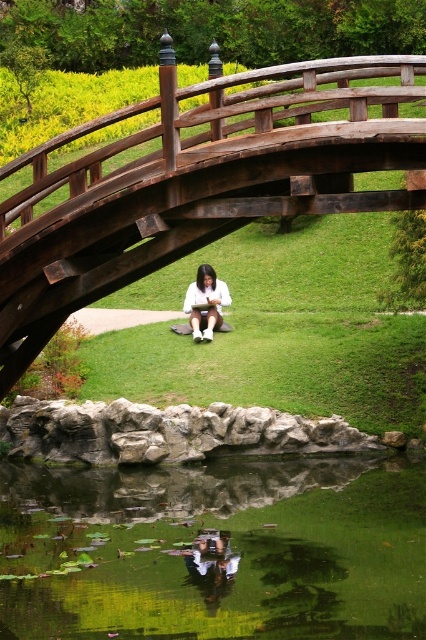
Question: Is green reflective water at center bottom thinner than white matte shirt at center?

Choices:
 (A) no
 (B) yes

Answer: (A)

Question: Is the position of green reflective water at center bottom more distant than that of white matte shirt at center?

Choices:
 (A) yes
 (B) no

Answer: (B)

Question: Which object appears farthest from the camera in this image?

Choices:
 (A) white matte shirt at center
 (B) dark brown wood bridge at center
 (C) green reflective water at center bottom

Answer: (A)

Question: Is green reflective water at center bottom to the left of white matte shirt at center from the viewer's perspective?

Choices:
 (A) no
 (B) yes

Answer: (A)

Question: Which point is farther to the camera?

Choices:
 (A) dark brown wood bridge at center
 (B) white matte shirt at center
 (C) green reflective water at center bottom

Answer: (B)

Question: Which of the following is the closest to the observer?

Choices:
 (A) (137, 605)
 (B) (17, 204)

Answer: (B)